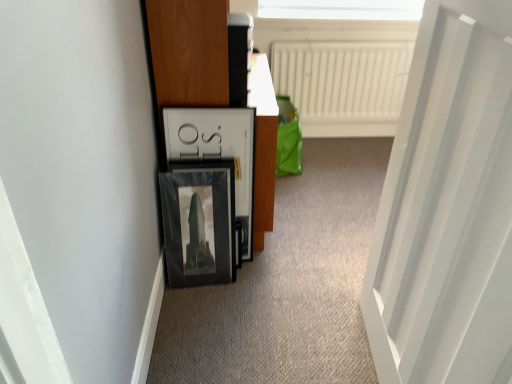
Question: Is wooden dresser at left wider or thinner than white smooth door at right?

Choices:
 (A) thin
 (B) wide

Answer: (B)

Question: Is wooden dresser at left in front of or behind white smooth door at right in the image?

Choices:
 (A) front
 (B) behind

Answer: (B)

Question: Which object is positioned closest to the white matte radiator at upper center?

Choices:
 (A) wooden dresser at left
 (B) white smooth door at right

Answer: (A)

Question: Which is farther from the white matte radiator at upper center?

Choices:
 (A) white smooth door at right
 (B) wooden dresser at left

Answer: (A)